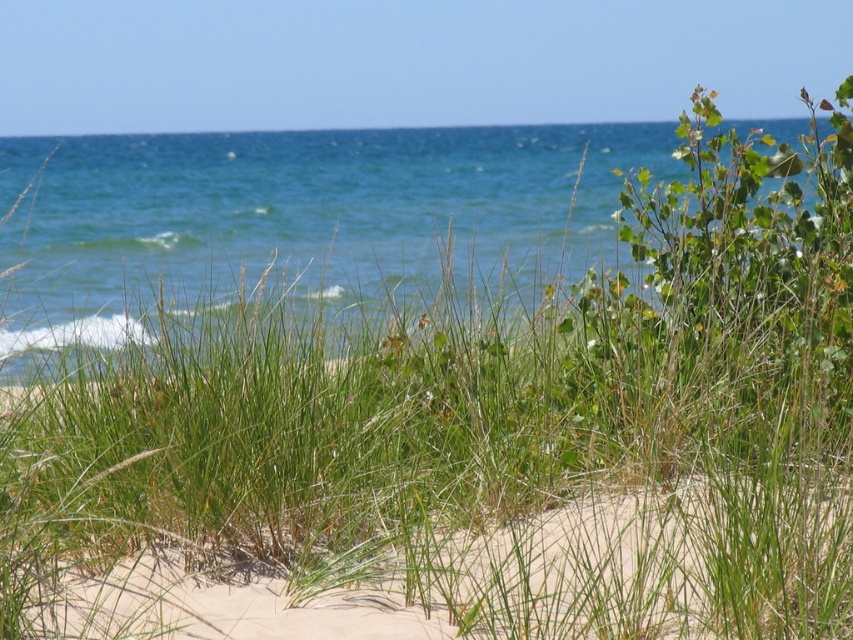
Between point (256, 189) and point (558, 598), which one is positioned behind?

The point (256, 189) is behind.

Does blue water at upper center have a smaller size compared to light beige sand at lower center?

Incorrect, blue water at upper center is not smaller in size than light beige sand at lower center.

Which is behind, point (410, 150) or point (181, 593)?

The point (410, 150) is behind.

Find the location of a particular element. This screenshot has height=640, width=853. blue water at upper center is located at coordinates (300, 214).